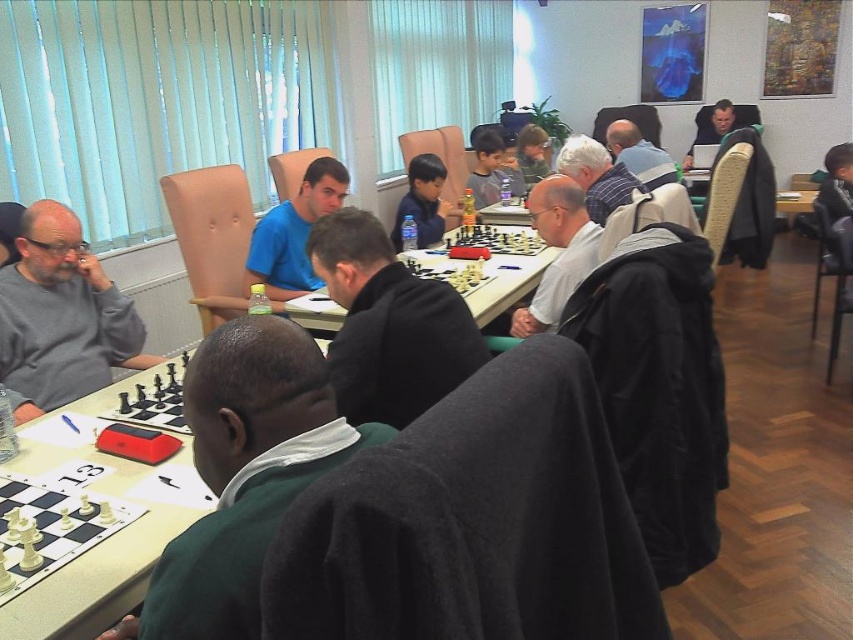
Which of these two, gray matte sweater at left or matte black jacket at upper center, stands taller?

gray matte sweater at left

Is point (53, 316) closer to camera compared to point (619, 141)?

Yes, it is.

Find the location of a particular element. gray matte sweater at left is located at coordinates (61, 316).

Between white matte jacket at center and wooden chessboard at center, which one is positioned higher?

white matte jacket at center is above.

Between point (527, 332) and point (440, 259), which one is positioned in front?

Point (527, 332) is more forward.

I want to click on white matte jacket at center, so click(x=558, y=252).

Between striped fabric robe at center and matte black shirt at center, which one has less height?

With less height is striped fabric robe at center.

Is point (596, 180) more distant than point (509, 172)?

That is False.

Locate an element on the screen. striped fabric robe at center is located at coordinates (610, 192).